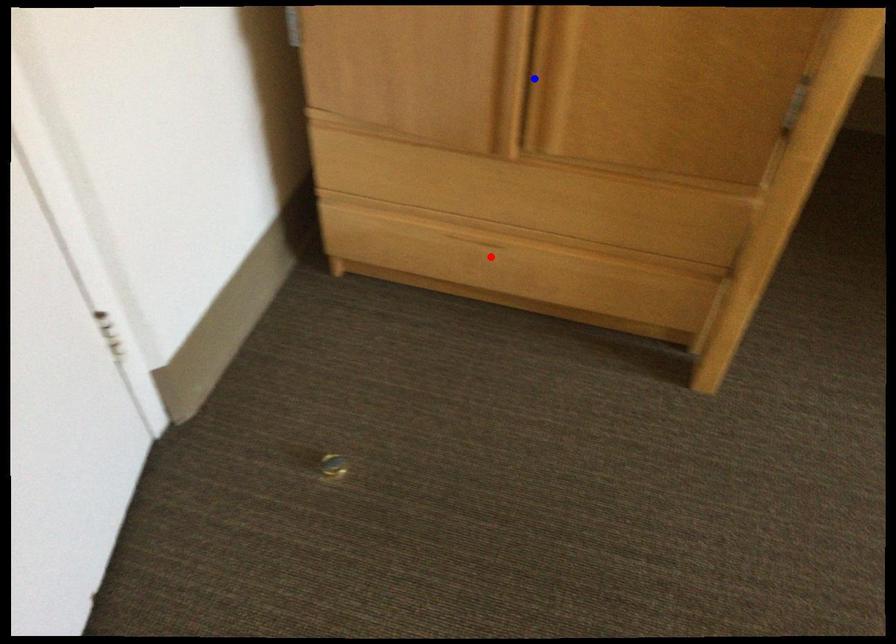
Question: In the image, two points are highlighted. Which point is nearer to the camera? Reply with the corresponding letter.

Choices:
 (A) blue point
 (B) red point

Answer: (A)